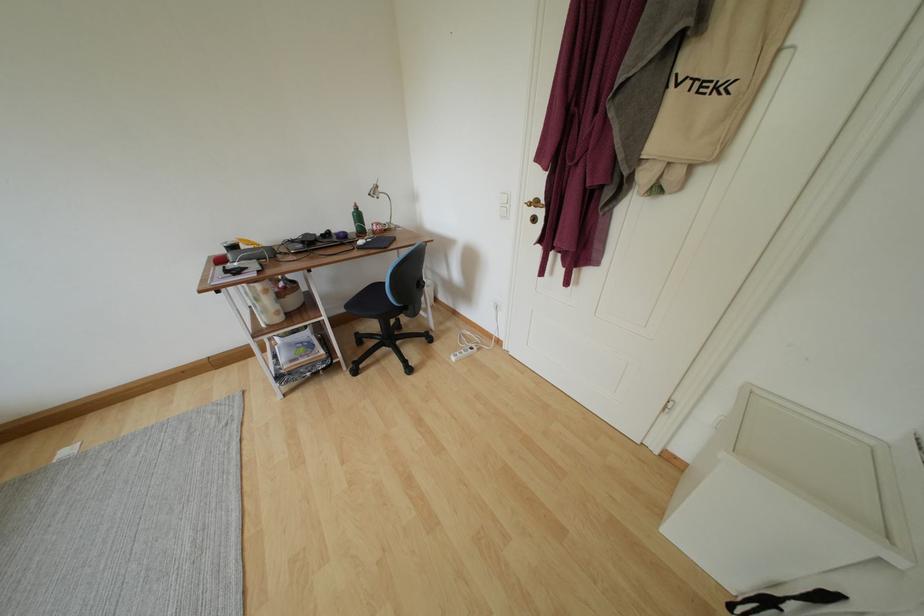
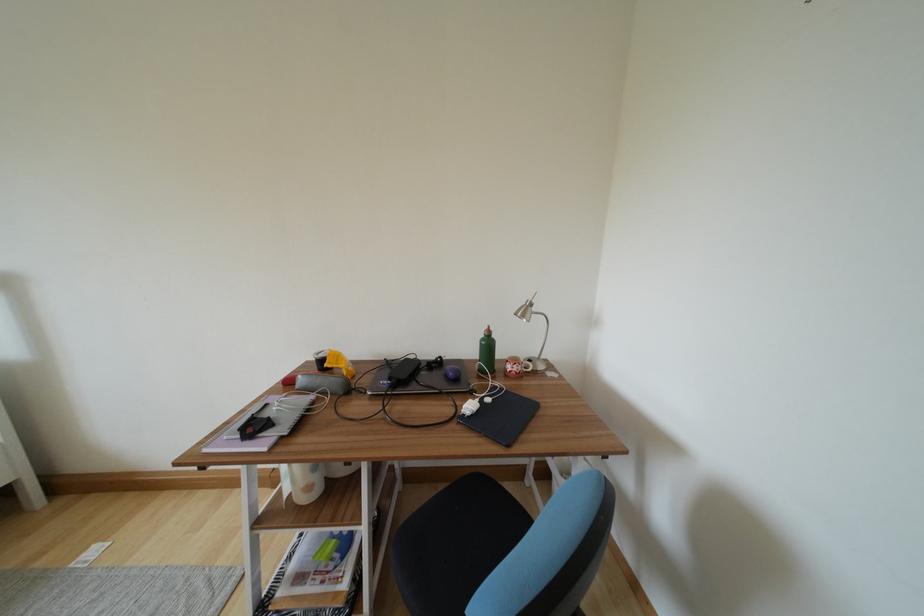
Locate, in the second image, the point that corresponds to (x=380, y=198) in the first image.

(528, 320)